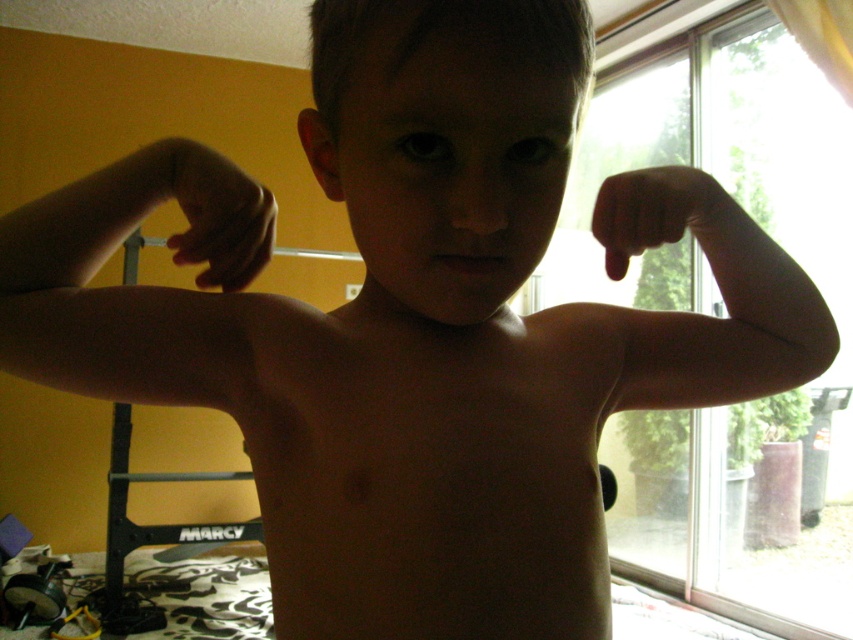
You are a photographer setting up a shot of the child in the room. You need to place two markers at the coordinates point (354, 564) and point (601, 228). Which marker should you place first to ensure it is in the foreground of the photo?

You should place the marker at point (354, 564) first because it is closer to the viewer than point (601, 228), ensuring it appears in the foreground.

You are a photographer setting up a shoot in this room. You want to position a small light source between the matte skin hand at upper center and the black matte hand at right to highlight both hands. Based on their positions, where should you place the light source?

The matte skin hand at upper center is below the black matte hand at right, so place the light source between them by positioning it just above the matte skin hand at upper center and below the black matte hand at right to illuminate both effectively.

In the scene shown: You are a photographer setting up a shoot in this room. You notice the lighting is uneven due to the bright window outside. To ensure proper exposure, you need to position a reflector to bounce light onto the matte skin hand at upper center. Given the current setup, where should you place the reflector relative to the point where the matte skin hand is located at point (216, 212)?

The reflector should be placed opposite the window, on the side of the matte skin hand at upper center that is currently in shadow to effectively bounce light onto it.